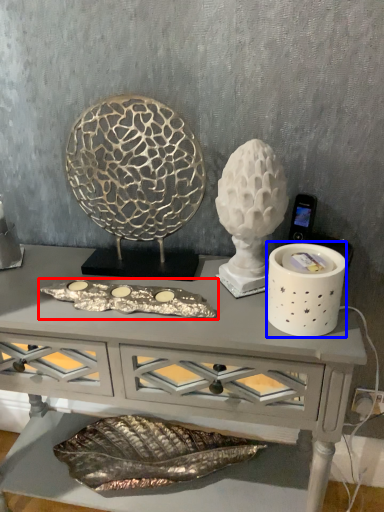
Question: Which object appears closest to the camera in this image, art (highlighted by a red box) or candle holder (highlighted by a blue box)?

Choices:
 (A) art
 (B) candle holder

Answer: (B)